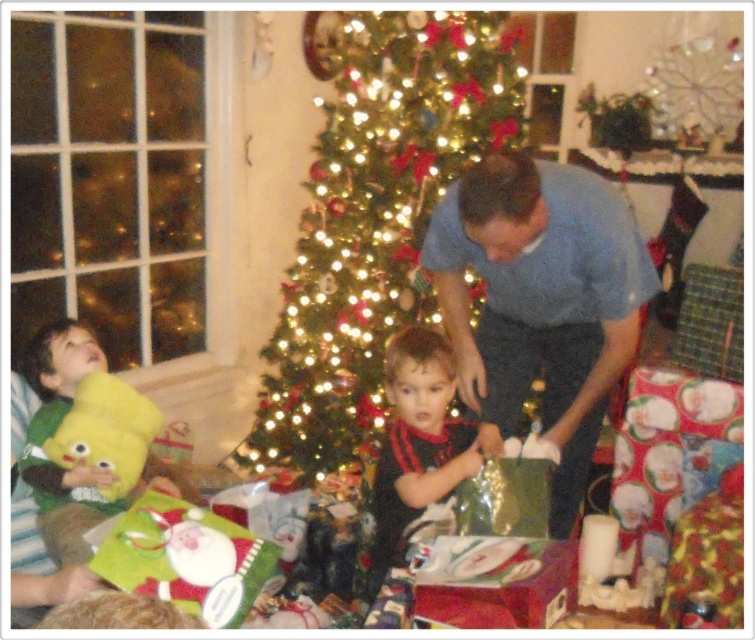
Image resolution: width=755 pixels, height=640 pixels. I want to click on green shiny tree at center, so click(x=374, y=220).

Between green shiny tree at center and yellow plush toy at left, which one is positioned higher?

green shiny tree at center

Locate an element on the screen. green shiny tree at center is located at coordinates tap(374, 220).

Between green shiny tree at center and black matte shirt at center, which one appears on the left side from the viewer's perspective?

Positioned to the left is green shiny tree at center.

Who is higher up, green shiny tree at center or black matte shirt at center?

green shiny tree at center is above.

Between point (482, 32) and point (433, 422), which one is positioned in front?

Point (433, 422) is in front.

Identify the location of green shiny tree at center. The image size is (755, 640). (374, 220).

Is the position of black matte shirt at center more distant than that of yellow plush toy at left?

Yes, black matte shirt at center is behind yellow plush toy at left.

Does point (387, 515) come in front of point (103, 445)?

No, it is behind (103, 445).

What are the coordinates of `black matte shirt at center` in the screenshot? It's located at click(418, 442).